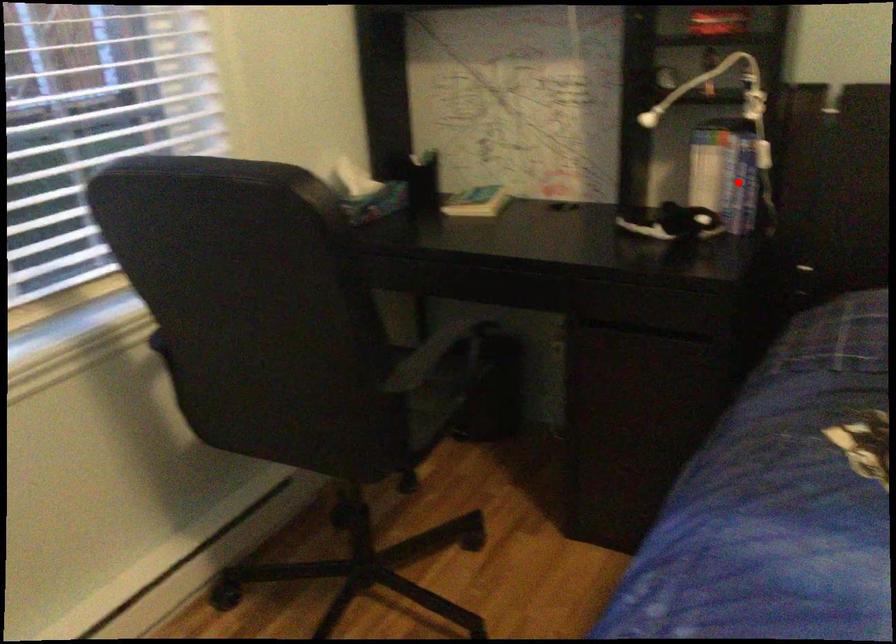
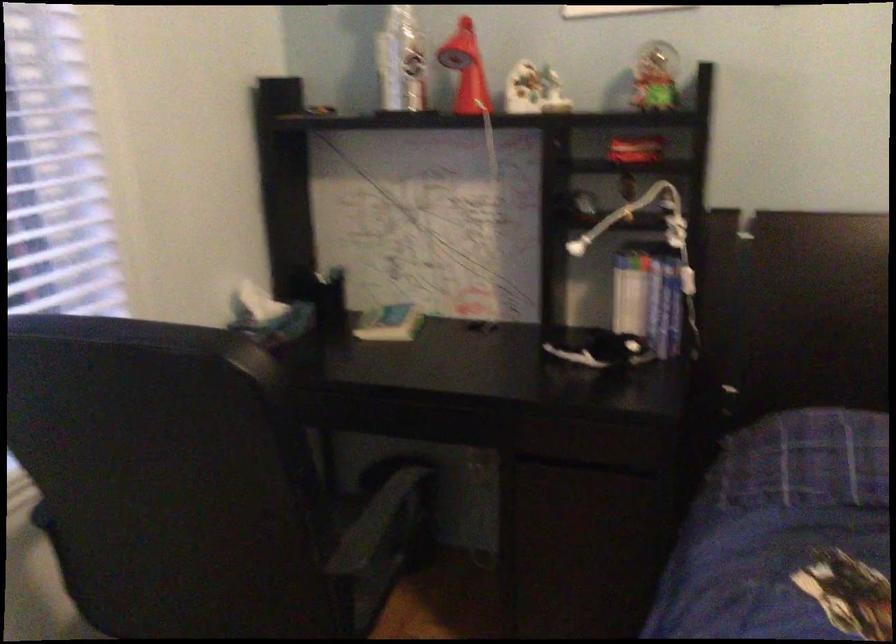
Find the pixel in the second image that matches the highlighted location in the first image.

(664, 307)